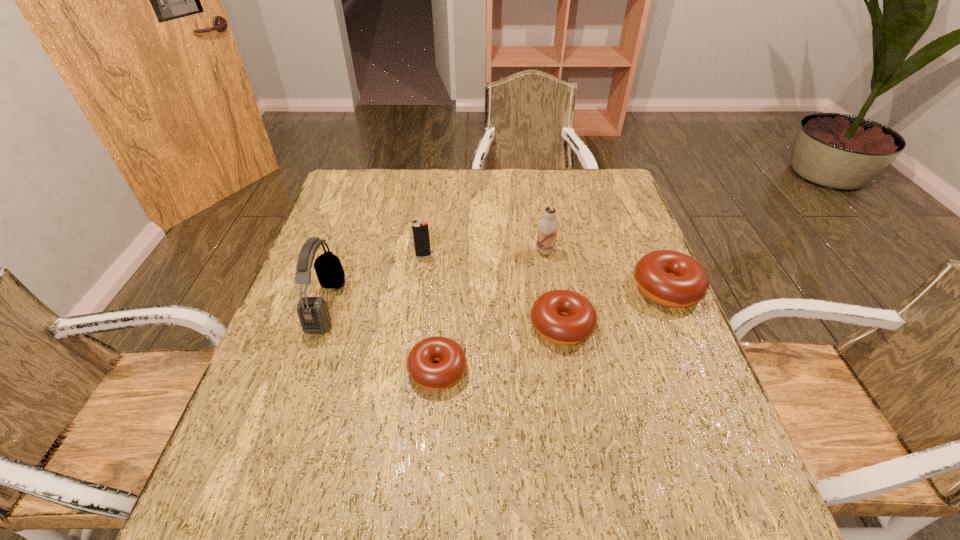
Identify the location of vacant area that lies between the igniter and the rightmost object. This screenshot has height=540, width=960. [x=545, y=272].

You are a GUI agent. You are given a task and a screenshot of the screen. Output one action in this format:
    pyautogui.click(x=<x>, y=<y>)
    Task: Click on the object that is the nearest to the igniter
    This screenshot has width=960, height=540.
    Given the screenshot: What is the action you would take?
    pyautogui.click(x=314, y=317)

You are a GUI agent. You are given a task and a screenshot of the screen. Output one action in this format:
    pyautogui.click(x=<x>, y=<y>)
    Task: Click on the second closest object to the rightmost doughnut
    
    Given the screenshot: What is the action you would take?
    pyautogui.click(x=548, y=226)

Locate which doughnut is the second closest to the third tallest object. Please provide its 2D coordinates. Your answer should be formatted as a tuple, i.e. [(x, y)], where the tuple contains the x and y coordinates of a point satisfying the conditions above.

[(564, 317)]

Select which doughnut appears as the second closest to the fifth tallest object. Please provide its 2D coordinates. Your answer should be formatted as a tuple, i.e. [(x, y)], where the tuple contains the x and y coordinates of a point satisfying the conditions above.

[(434, 376)]

Where is `free space that satisfies the following two spatial constraints: 1. on the headband of the headset; 2. on the back side of the second tallest doughnut`? free space that satisfies the following two spatial constraints: 1. on the headband of the headset; 2. on the back side of the second tallest doughnut is located at coordinates click(x=320, y=326).

At what (x,y) coordinates should I click in order to perform the action: click on vacant region that satisfies the following two spatial constraints: 1. on the front side of the third tallest object; 2. on the headband of the headset. Please return your answer as a coordinate pair (x, y). This screenshot has height=540, width=960. Looking at the image, I should click on (417, 305).

Locate an element on the screen. blank area in the image that satisfies the following two spatial constraints: 1. on the front side of the igniter; 2. on the right side of the second shortest object is located at coordinates (414, 326).